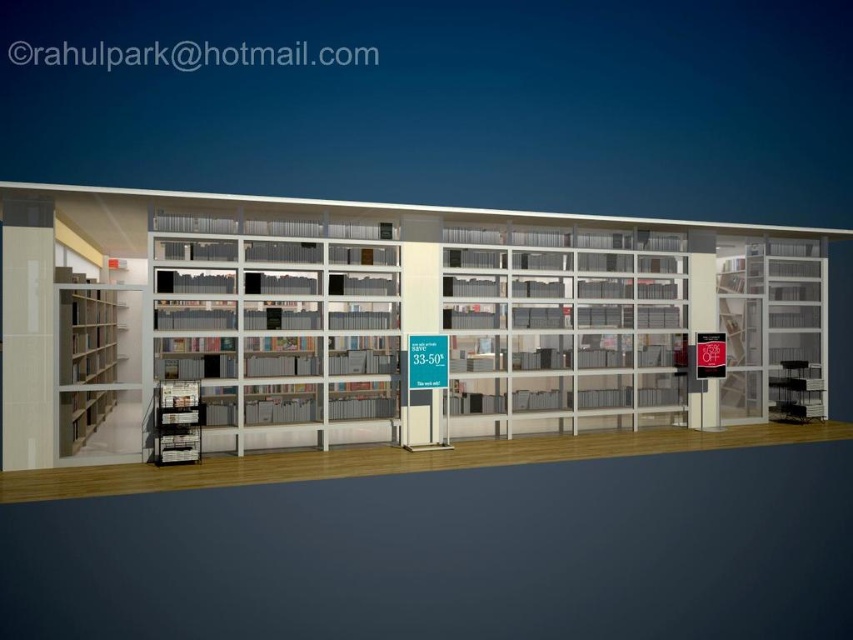
From the picture: You are a customer in the bookstore and want to find a book that is displayed on the white glossy bookcase at center. Which direction should you move from the clear glass bookcase at center to reach it?

The white glossy bookcase at center is to the right of the clear glass bookcase at center, so you should move to the right to reach it.

You are a customer looking to find a specific book in a modern bookstore. You see the white glossy bookcase at center and the wooden bookshelf at left. Which one has more space between its shelves to accommodate thicker books?

The white glossy bookcase at center has a larger size compared to wooden bookshelf at left, so it likely has more space between its shelves to accommodate thicker books.